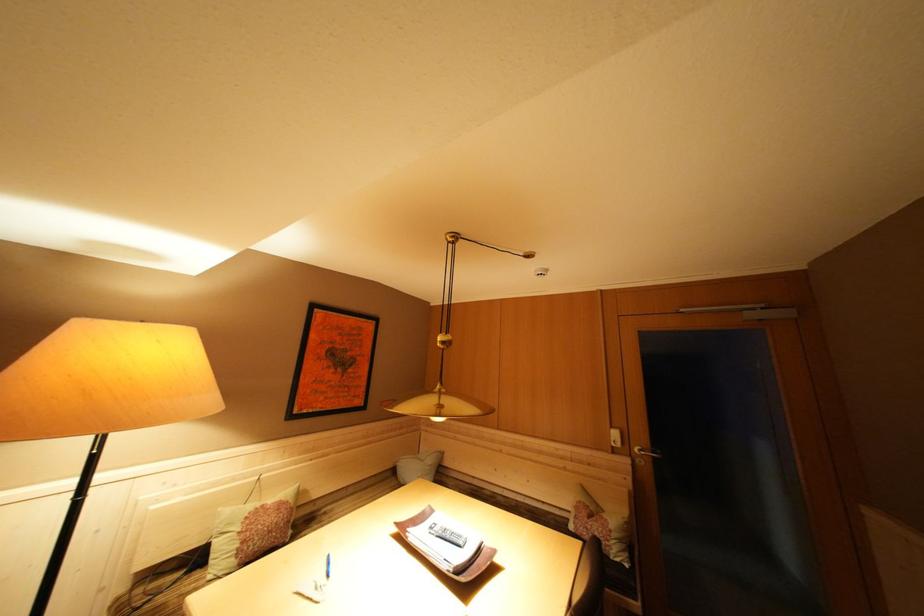
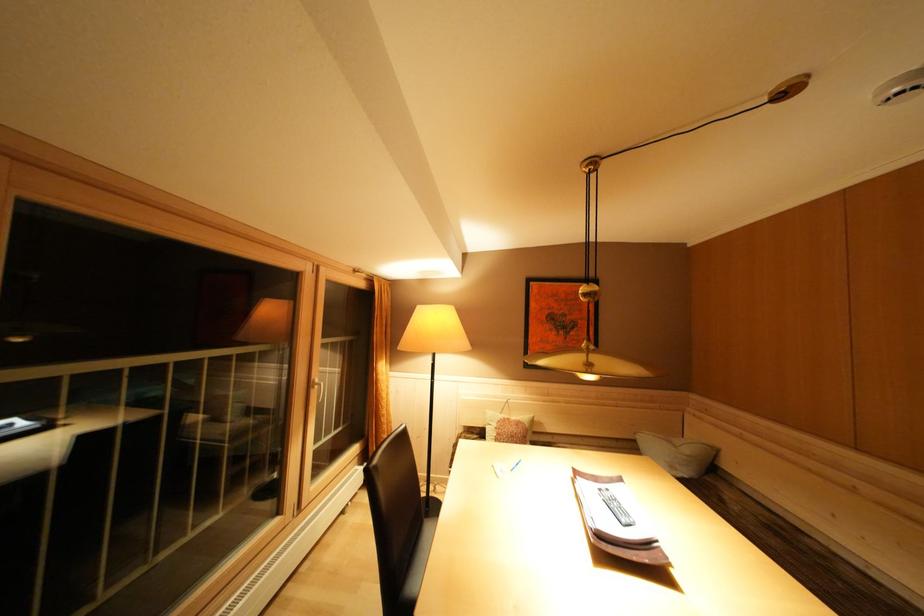
Find the pixel in the second image that matches point (438, 533) in the first image.

(608, 495)